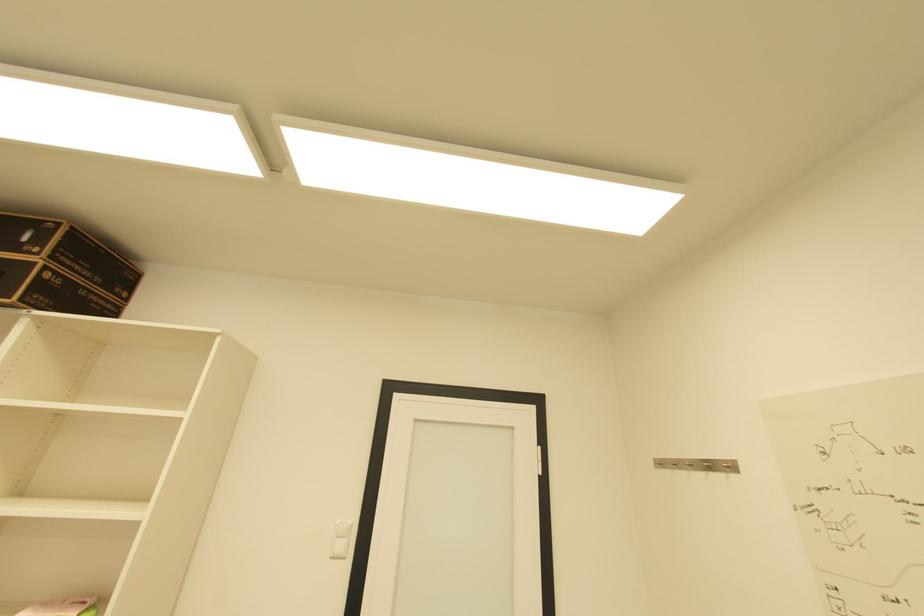
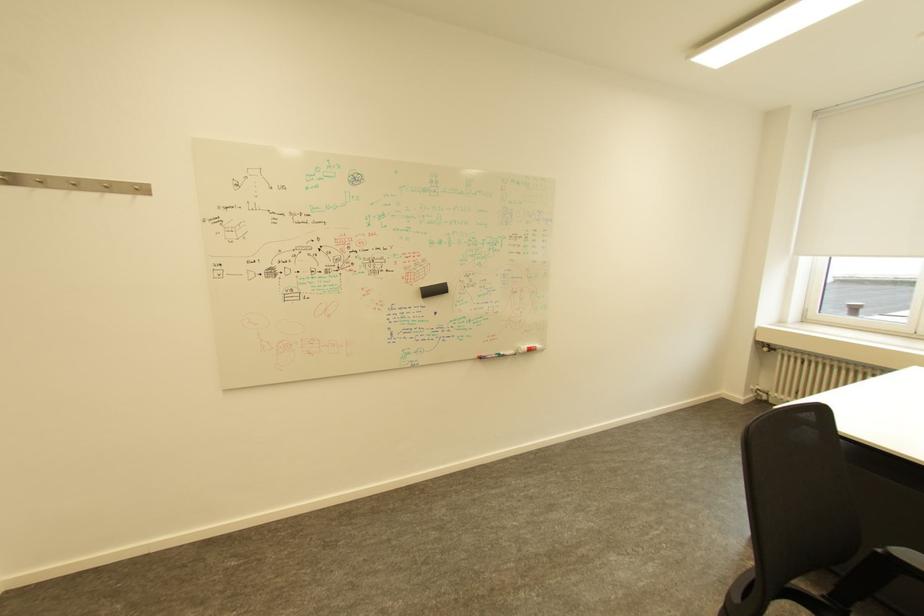
Question: The camera is either moving clockwise (left) or counter-clockwise (right) around the object. The first image is from the beginning of the video and the second image is from the end. Is the camera moving left or right when shooting the video?

Choices:
 (A) Left
 (B) Right

Answer: (A)